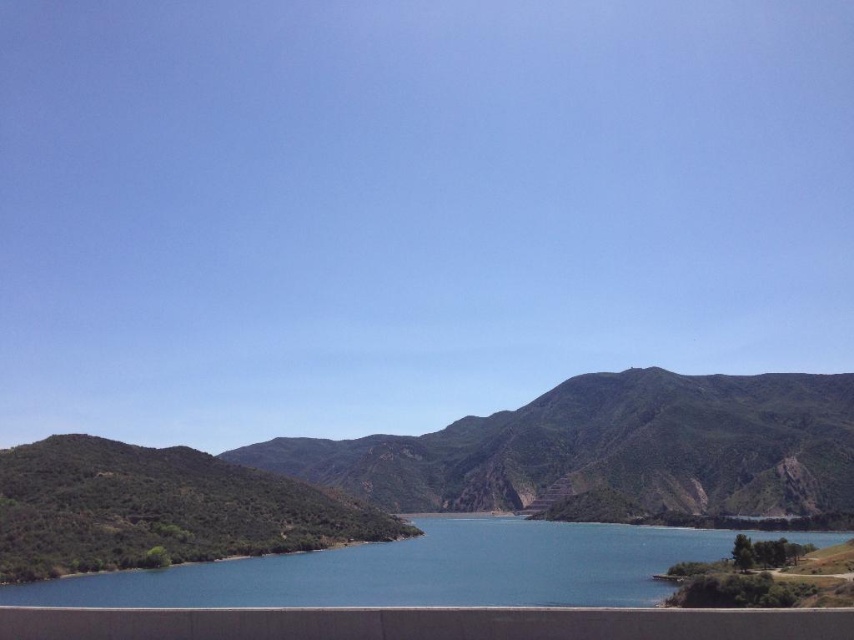
You are standing at the edge of the blue water at center and want to walk towards the green textured hillside at center. In which direction should you head?

You should head to the left because the green textured hillside at center is located to the left of the blue water at center.

You are standing at the edge of the lake and want to walk towards the mountains in the background. Which object will you pass first, the green textured hillside at center or the blue water at center?

The green textured hillside at center is closer to you than the blue water at center, so you will pass the green textured hillside at center first.